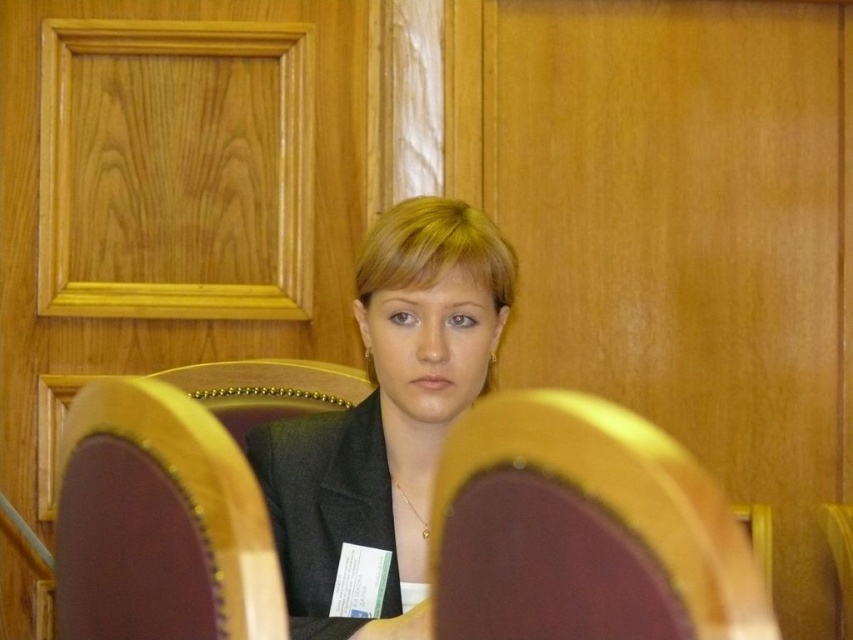
You are organizing a photo shoot and need to position two items correctly. The maroon fabric chair at center and the matte black suit at center must be arranged according to their original positions. From the photographer standing in front of the scene, which object is positioned to the right?

The maroon fabric chair at center is to the right of the matte black suit at center, so from the photographer standing in front of the scene, the maroon fabric chair at center is positioned to the right.

You are an interior designer planning to add a new rug to the room. The rug must be placed between the maroon fabric chair at center and the matte black suit at center. Is this possible given their positions?

The maroon fabric chair at center is located below the matte black suit at center, so placing a rug between them vertically is not feasible since they are stacked vertically rather than separated horizontally.